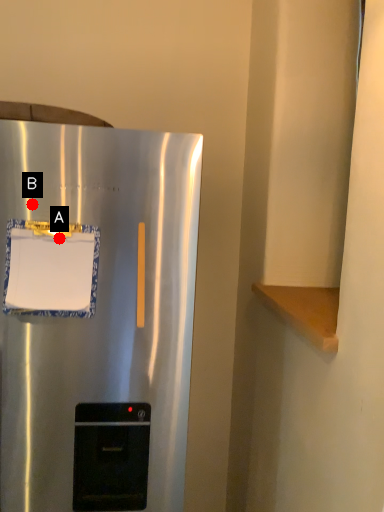
Question: Two points are circled on the image, labeled by A and B beside each circle. Which of the following is the closest to the observer?

Choices:
 (A) A is closer
 (B) B is closer

Answer: (A)